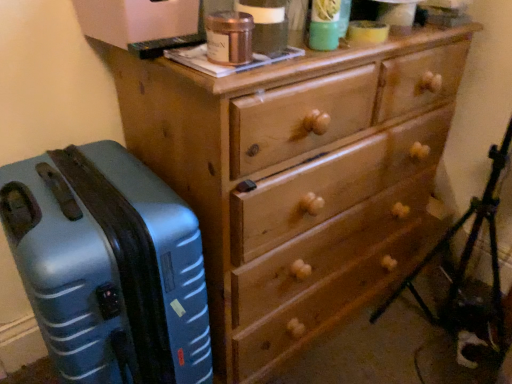
Question: Relative to wooden chest of drawers at center, is blue matte suitcase at left in front or behind?

Choices:
 (A) front
 (B) behind

Answer: (A)

Question: Is blue matte suitcase at left situated inside wooden chest of drawers at center or outside?

Choices:
 (A) outside
 (B) inside

Answer: (A)

Question: Looking at their shapes, would you say blue matte suitcase at left is wider or thinner than wooden chest of drawers at center?

Choices:
 (A) wide
 (B) thin

Answer: (B)

Question: Looking at the image, does wooden chest of drawers at center seem bigger or smaller compared to blue matte suitcase at left?

Choices:
 (A) small
 (B) big

Answer: (B)

Question: Is wooden chest of drawers at center taller or shorter than blue matte suitcase at left?

Choices:
 (A) tall
 (B) short

Answer: (A)

Question: Considering the positions of wooden chest of drawers at center and blue matte suitcase at left in the image, is wooden chest of drawers at center wider or thinner than blue matte suitcase at left?

Choices:
 (A) wide
 (B) thin

Answer: (A)

Question: From a real-world perspective, is wooden chest of drawers at center positioned above or below blue matte suitcase at left?

Choices:
 (A) below
 (B) above

Answer: (B)